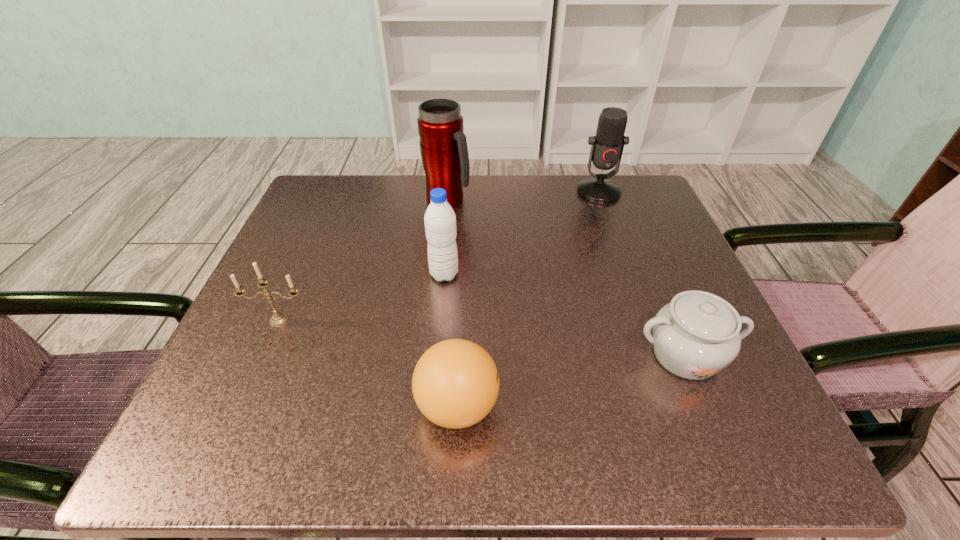
Where is `empty space that is in between the microphone and the chinaware`? empty space that is in between the microphone and the chinaware is located at coordinates (642, 273).

Identify the location of vacant space that is in between the thermos bottle and the chinaware. (566, 278).

Where is `free area in between the chinaware and the water bottle`? The image size is (960, 540). free area in between the chinaware and the water bottle is located at coordinates (564, 315).

You are a GUI agent. You are given a task and a screenshot of the screen. Output one action in this format:
    pyautogui.click(x=<x>, y=<y>)
    Task: Click on the free space that is in between the chinaware and the microphone
    
    Given the screenshot: What is the action you would take?
    pyautogui.click(x=642, y=273)

Locate which object is the third closest to the chinaware. Please provide its 2D coordinates. Your answer should be formatted as a tuple, i.e. [(x, y)], where the tuple contains the x and y coordinates of a point satisfying the conditions above.

[(607, 146)]

Locate which object ranks fourth in proximity to the microphone. Please provide its 2D coordinates. Your answer should be formatted as a tuple, i.e. [(x, y)], where the tuple contains the x and y coordinates of a point satisfying the conditions above.

[(455, 384)]

The height and width of the screenshot is (540, 960). Identify the location of vacant area in the image that satisfies the following two spatial constraints: 1. on the front side of the water bottle; 2. on the left side of the chinaware. (437, 355).

The height and width of the screenshot is (540, 960). Find the location of `free point that satisfies the following two spatial constraints: 1. on the side with the handle of the thermos bottle; 2. on the left side of the water bottle`. free point that satisfies the following two spatial constraints: 1. on the side with the handle of the thermos bottle; 2. on the left side of the water bottle is located at coordinates (441, 275).